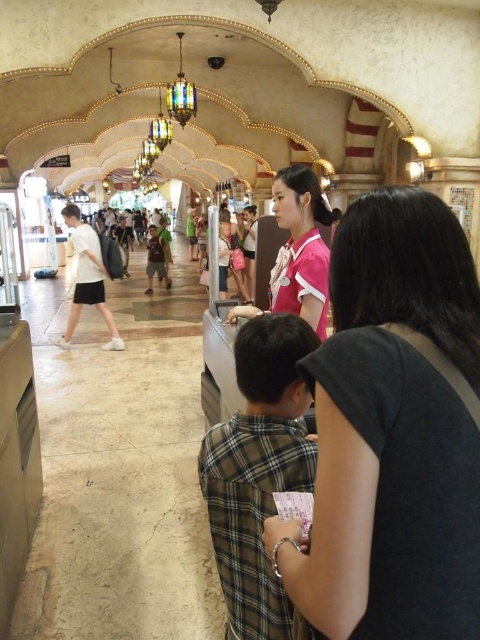
From the picture: Between pink fabric shirt at center and white matte shirt at center, which one has less height?

Standing shorter between the two is pink fabric shirt at center.

Between point (418, 298) and point (99, 284), which one is positioned in front?

Point (418, 298) is in front.

Find the location of a particular element. The image size is (480, 640). pink fabric shirt at center is located at coordinates (392, 435).

This screenshot has height=640, width=480. In order to click on pink fabric shirt at center in this screenshot , I will do `click(392, 435)`.

At what (x,y) coordinates should I click in order to perform the action: click on white matte shirt at center. Please return your answer as a coordinate pair (x, y). Image resolution: width=480 pixels, height=640 pixels. Looking at the image, I should click on (87, 278).

Which is more to the right, white matte shirt at center or green fabric shirt at center?

Positioned to the right is white matte shirt at center.

Image resolution: width=480 pixels, height=640 pixels. Find the location of `white matte shirt at center`. white matte shirt at center is located at coordinates (87, 278).

Does pink fabric shirt at center have a lesser width compared to green fabric shirt at center?

Indeed, pink fabric shirt at center has a lesser width compared to green fabric shirt at center.

From the picture: Which of these two, pink fabric shirt at center or green fabric shirt at center, stands taller?

green fabric shirt at center

Locate an element on the screen. The width and height of the screenshot is (480, 640). pink fabric shirt at center is located at coordinates (392, 435).